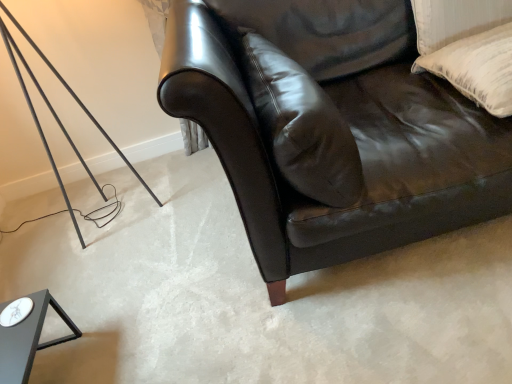
Question: Is white textured pillow at upper right, the second pillow viewed from the left, turned away from shiny black leather couch at center?

Choices:
 (A) no
 (B) yes

Answer: (B)

Question: Does white textured pillow at upper right, the first pillow positioned from the right, appear on the left side of shiny black leather couch at center?

Choices:
 (A) yes
 (B) no

Answer: (B)

Question: From a real-world perspective, is white textured pillow at upper right, the first pillow positioned from the right, located beneath shiny black leather couch at center?

Choices:
 (A) yes
 (B) no

Answer: (B)

Question: Considering the relative positions of white textured pillow at upper right, the second pillow viewed from the left, and shiny black leather couch at center in the image provided, is white textured pillow at upper right, the second pillow viewed from the left, to the right of shiny black leather couch at center from the viewer's perspective?

Choices:
 (A) yes
 (B) no

Answer: (A)

Question: Considering the relative sizes of white textured pillow at upper right, the second pillow viewed from the left, and shiny black leather couch at center in the image provided, is white textured pillow at upper right, the second pillow viewed from the left, smaller than shiny black leather couch at center?

Choices:
 (A) yes
 (B) no

Answer: (A)

Question: Does point (470, 41) appear closer or farther from the camera than point (296, 163)?

Choices:
 (A) closer
 (B) farther

Answer: (B)

Question: Considering the positions of white textured pillow at upper right, the second pillow viewed from the left, and leather pillow at center, the first pillow when ordered from left to right, in the image, is white textured pillow at upper right, the second pillow viewed from the left, taller or shorter than leather pillow at center, the first pillow when ordered from left to right,?

Choices:
 (A) tall
 (B) short

Answer: (B)

Question: Is white textured pillow at upper right, the first pillow positioned from the right, bigger or smaller than leather pillow at center, which is the second pillow from right to left?

Choices:
 (A) small
 (B) big

Answer: (A)

Question: Is white textured pillow at upper right, the second pillow viewed from the left, spatially inside leather pillow at center, which is the second pillow from right to left, or outside of it?

Choices:
 (A) outside
 (B) inside

Answer: (A)

Question: Considering their positions, is leather pillow at center, which is the second pillow from right to left, located in front of or behind white textured pillow at upper right, the second pillow viewed from the left?

Choices:
 (A) behind
 (B) front

Answer: (B)

Question: Considering the positions of point (283, 135) and point (423, 69), is point (283, 135) closer or farther from the camera than point (423, 69)?

Choices:
 (A) closer
 (B) farther

Answer: (A)

Question: Considering the positions of leather pillow at center, the first pillow when ordered from left to right, and white textured pillow at upper right, the second pillow viewed from the left, in the image, is leather pillow at center, the first pillow when ordered from left to right, wider or thinner than white textured pillow at upper right, the second pillow viewed from the left,?

Choices:
 (A) thin
 (B) wide

Answer: (A)

Question: Choose the correct answer: Is leather pillow at center, the first pillow when ordered from left to right, inside white textured pillow at upper right, the second pillow viewed from the left, or outside it?

Choices:
 (A) outside
 (B) inside

Answer: (A)

Question: In the image, is leather pillow at center, the first pillow when ordered from left to right, on the left side or the right side of shiny black leather couch at center?

Choices:
 (A) left
 (B) right

Answer: (A)

Question: In terms of size, does leather pillow at center, the first pillow when ordered from left to right, appear bigger or smaller than shiny black leather couch at center?

Choices:
 (A) big
 (B) small

Answer: (B)